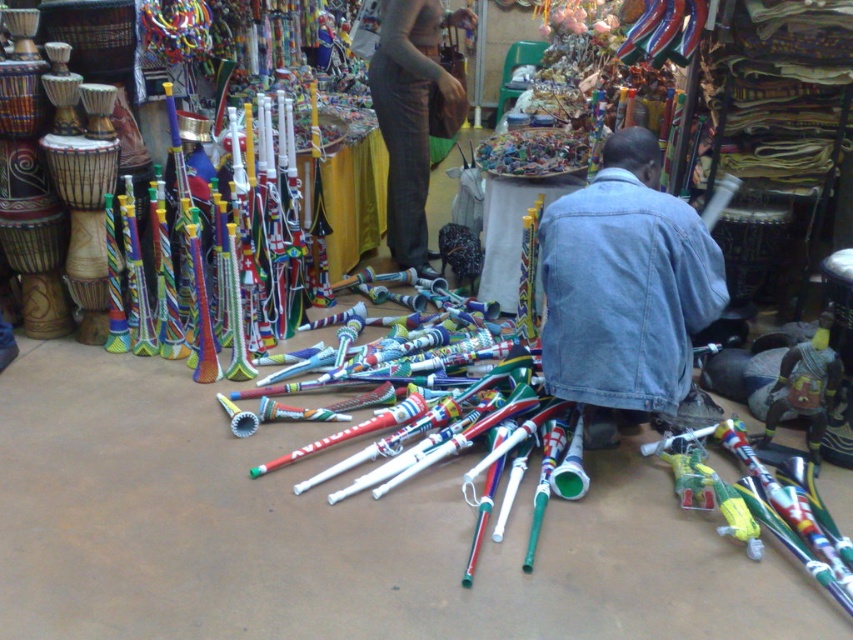
You are a customer at the market and want to buy both the denim jacket at lower right and dark gray pants at center. However, you have a small backpack with a width capacity of 30 cm. Can you fit both items into your backpack without folding them?

The denim jacket at lower right might be wider than dark gray pants at center. Since the backpack has a width capacity of 30 cm, it is uncertain if both items can fit without folding. You should check the actual width of the denim jacket at lower right to ensure it doesn

You are a customer at this market and want to buy both the denim jacket at lower right and the dark gray pants at center. However, you notice that the vendor has placed them in a way that one is hidden behind the other. Which item is more visible to you from your current position?

The dark gray pants at center are more visible because the denim jacket at lower right is located below them, meaning it is hidden underneath.

You are a customer at the market and want to pick up the denim jacket at lower right and the dark gray pants at center. Which item would you need to move first to access the other?

The denim jacket at lower right is in front of the dark gray pants at center, so you would need to move the denim jacket at lower right first to access the dark gray pants at center.